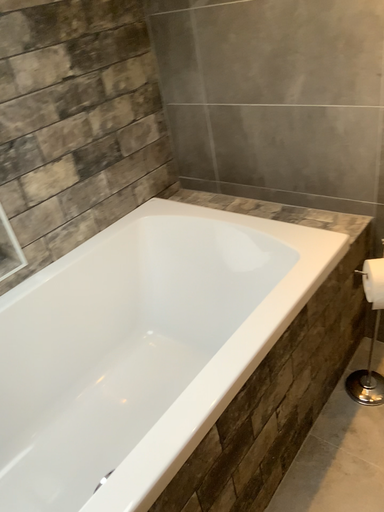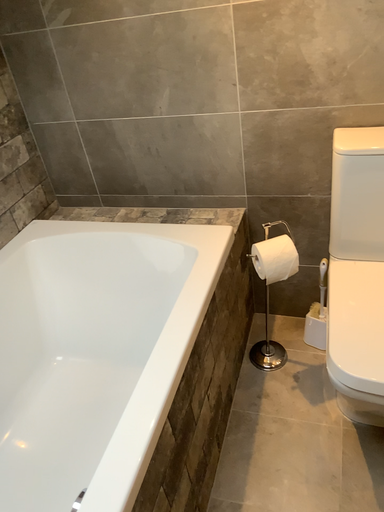
Question: How did the camera likely rotate when shooting the video?

Choices:
 (A) rotated right
 (B) rotated left

Answer: (A)